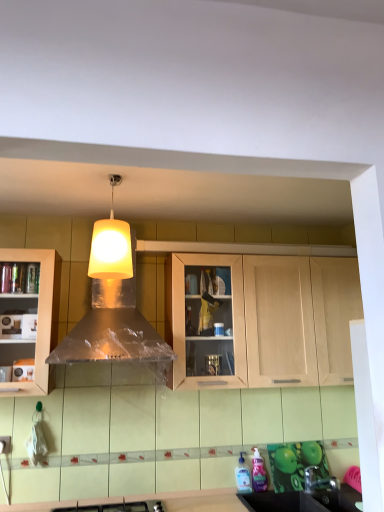
What do you see at coordinates (304, 500) in the screenshot? I see `black plastic sink at lower right` at bounding box center [304, 500].

This screenshot has width=384, height=512. Find the location of `translucent plastic bottle at lower center, the second bottle from the left`. translucent plastic bottle at lower center, the second bottle from the left is located at coordinates (259, 473).

What do you see at coordinates (113, 326) in the screenshot? I see `metallic silver hood at center` at bounding box center [113, 326].

This screenshot has height=512, width=384. I want to click on metallic silver hood at center, so click(113, 326).

You are a GUI agent. You are given a task and a screenshot of the screen. Output one action in this format:
    pyautogui.click(x=<x>, y=<y>)
    Task: Click on the translucent plastic bottle at lower center, which ranks as the second bottle in right-to-left order
    The width and height of the screenshot is (384, 512).
    Given the screenshot: What is the action you would take?
    pyautogui.click(x=243, y=476)

What do you see at coordinates (243, 476) in the screenshot? I see `translucent plastic bottle at lower center, which ranks as the second bottle in right-to-left order` at bounding box center [243, 476].

At what (x,y) coordinates should I click in order to perform the action: click on black plastic sink at lower right. Please return your answer as a coordinate pair (x, y). This screenshot has width=384, height=512. Looking at the image, I should click on (304, 500).

Is point (241, 473) positioned after point (107, 219)?

No, it is in front of (107, 219).

From a real-world perspective, is translucent plastic bottle at lower center, positioned as the 1th bottle in left-to-right order, under white matte lampshade at upper center?

Yes.

Who is smaller, translucent plastic bottle at lower center, positioned as the 1th bottle in left-to-right order, or white matte lampshade at upper center?

translucent plastic bottle at lower center, positioned as the 1th bottle in left-to-right order, is smaller.

Relative to white matte lampshade at upper center, is translucent plastic bottle at lower center, which ranks as the second bottle in right-to-left order, in front or behind?

translucent plastic bottle at lower center, which ranks as the second bottle in right-to-left order, is positioned farther from the viewer than white matte lampshade at upper center.

Considering the relative sizes of metallic silver hood at center and translucent plastic bottle at lower center, the second bottle from the left, in the image provided, is metallic silver hood at center shorter than translucent plastic bottle at lower center, the second bottle from the left,?

No.

Identify the location of hood that is on the left side of translucent plastic bottle at lower center, acting as the first bottle starting from the right. (113, 326).

Which is behind, metallic silver hood at center or translucent plastic bottle at lower center, the second bottle from the left?

translucent plastic bottle at lower center, the second bottle from the left.

Is metallic silver hood at center facing away from translucent plastic bottle at lower center, the second bottle from the left?

metallic silver hood at center is not turned away from translucent plastic bottle at lower center, the second bottle from the left.

Find the location of a particular element. cabinetry located above the black plastic sink at lower right (from a real-world perspective) is located at coordinates (266, 321).

From the image's perspective, which is above, black plastic sink at lower right or light wood cabinet at center?

light wood cabinet at center.

Are black plastic sink at lower right and light wood cabinet at center beside each other?

No, black plastic sink at lower right is not in contact with light wood cabinet at center.

Which is correct: black plastic sink at lower right is inside light wood cabinet at center, or outside of it?

black plastic sink at lower right is outside light wood cabinet at center.

Is point (329, 480) closer to viewer compared to point (284, 349)?

No.

Is satin nickel faucet at lower right not close to light wood cabinet at center?

No, satin nickel faucet at lower right is not far from light wood cabinet at center.

Is satin nickel faucet at lower right wider than light wood cabinet at center?

No, satin nickel faucet at lower right is not wider than light wood cabinet at center.

From a real-world perspective, is satin nickel faucet at lower right positioned above or below light wood cabinet at center?

From a real-world perspective, satin nickel faucet at lower right is physically below light wood cabinet at center.

The image size is (384, 512). I want to click on cabinetry in front of the translucent plastic bottle at lower center, acting as the first bottle starting from the right, so click(266, 321).

Does light wood cabinet at center have a lesser width compared to translucent plastic bottle at lower center, the second bottle from the left?

No, light wood cabinet at center is not thinner than translucent plastic bottle at lower center, the second bottle from the left.

Is light wood cabinet at center next to translucent plastic bottle at lower center, the second bottle from the left, and touching it?

light wood cabinet at center and translucent plastic bottle at lower center, the second bottle from the left, are clearly separated.

Does light wood cabinet at center turn towards translucent plastic bottle at lower center, the second bottle from the left?

No, light wood cabinet at center is not oriented towards translucent plastic bottle at lower center, the second bottle from the left.

From a real-world perspective, does metallic silver hood at center sit lower than white matte lampshade at upper center?

Yes, from a real-world perspective, metallic silver hood at center is under white matte lampshade at upper center.

From the image's perspective, is metallic silver hood at center on top of white matte lampshade at upper center?

No, from the image's perspective, metallic silver hood at center is not over white matte lampshade at upper center.

Can you confirm if metallic silver hood at center is positioned to the right of white matte lampshade at upper center?

No, metallic silver hood at center is not to the right of white matte lampshade at upper center.

Who is taller, metallic silver hood at center or white matte lampshade at upper center?

metallic silver hood at center is taller.

From the picture: Is translucent plastic bottle at lower center, which ranks as the second bottle in right-to-left order, beside translucent plastic bottle at lower center, the second bottle from the left?

Absolutely, translucent plastic bottle at lower center, which ranks as the second bottle in right-to-left order, is next to and touching translucent plastic bottle at lower center, the second bottle from the left.

Considering the relative sizes of translucent plastic bottle at lower center, positioned as the 1th bottle in left-to-right order, and translucent plastic bottle at lower center, acting as the first bottle starting from the right, in the image provided, is translucent plastic bottle at lower center, positioned as the 1th bottle in left-to-right order, shorter than translucent plastic bottle at lower center, acting as the first bottle starting from the right,?

Indeed, translucent plastic bottle at lower center, positioned as the 1th bottle in left-to-right order, has a lesser height compared to translucent plastic bottle at lower center, acting as the first bottle starting from the right.

How many degrees apart are the facing directions of translucent plastic bottle at lower center, positioned as the 1th bottle in left-to-right order, and translucent plastic bottle at lower center, the second bottle from the left?

2.12 degrees separate the facing orientations of translucent plastic bottle at lower center, positioned as the 1th bottle in left-to-right order, and translucent plastic bottle at lower center, the second bottle from the left.

From a real-world perspective, relative to translucent plastic bottle at lower center, acting as the first bottle starting from the right, is translucent plastic bottle at lower center, which ranks as the second bottle in right-to-left order, vertically above or below?

Clearly, from a real-world perspective, translucent plastic bottle at lower center, which ranks as the second bottle in right-to-left order, is below translucent plastic bottle at lower center, acting as the first bottle starting from the right.

Locate an element on the screen. The height and width of the screenshot is (512, 384). light fixture in front of the translucent plastic bottle at lower center, which ranks as the second bottle in right-to-left order is located at coordinates point(111,245).

The width and height of the screenshot is (384, 512). Identify the location of hood above the translucent plastic bottle at lower center, the second bottle from the left (from a real-world perspective). (113, 326).

Looking at the image, which one is located further to light wood cabinet at center, black plastic sink at lower right or white matte lampshade at upper center?

black plastic sink at lower right.

Considering their positions, is translucent plastic bottle at lower center, acting as the first bottle starting from the right, positioned further to translucent plastic bottle at lower center, positioned as the 1th bottle in left-to-right order, than satin nickel faucet at lower right?

Among the two, satin nickel faucet at lower right is located further to translucent plastic bottle at lower center, positioned as the 1th bottle in left-to-right order.

When comparing their distances from light wood cabinet at center, does metallic silver hood at center or white matte lampshade at upper center seem further?

white matte lampshade at upper center is further to light wood cabinet at center.

Looking at the image, which one is located further to translucent plastic bottle at lower center, positioned as the 1th bottle in left-to-right order, satin nickel faucet at lower right or white matte lampshade at upper center?

Based on the image, white matte lampshade at upper center appears to be further to translucent plastic bottle at lower center, positioned as the 1th bottle in left-to-right order.

Looking at the image, which one is located further to translucent plastic bottle at lower center, the second bottle from the left, translucent plastic bottle at lower center, which ranks as the second bottle in right-to-left order, or light wood cabinet at center?

light wood cabinet at center lies further to translucent plastic bottle at lower center, the second bottle from the left, than the other object.

Which object lies further to the anchor point white matte lampshade at upper center, satin nickel faucet at lower right or light wood cabinet at center?

satin nickel faucet at lower right lies further to white matte lampshade at upper center than the other object.

From the image, which object appears to be nearer to translucent plastic bottle at lower center, the second bottle from the left, metallic silver hood at center or satin nickel faucet at lower right?

The object closer to translucent plastic bottle at lower center, the second bottle from the left, is satin nickel faucet at lower right.

When comparing their distances from light wood cabinet at center, does white matte lampshade at upper center or metallic silver hood at center seem closer?

The object closer to light wood cabinet at center is metallic silver hood at center.

Where is `cabinetry between white matte lampshade at upper center and translucent plastic bottle at lower center, acting as the first bottle starting from the right, in the vertical direction`? Image resolution: width=384 pixels, height=512 pixels. cabinetry between white matte lampshade at upper center and translucent plastic bottle at lower center, acting as the first bottle starting from the right, in the vertical direction is located at coordinates [x=266, y=321].

This screenshot has width=384, height=512. I want to click on faucet between white matte lampshade at upper center and black plastic sink at lower right from top to bottom, so click(x=318, y=481).

In order to click on bottle between black plastic sink at lower right and translucent plastic bottle at lower center, the second bottle from the left, in the front-back direction in this screenshot , I will do pos(243,476).

You are a GUI agent. You are given a task and a screenshot of the screen. Output one action in this format:
    pyautogui.click(x=<x>, y=<y>)
    Task: Click on the cabinetry between white matte lampshade at upper center and black plastic sink at lower right from top to bottom
    This screenshot has width=384, height=512.
    Given the screenshot: What is the action you would take?
    pyautogui.click(x=266, y=321)